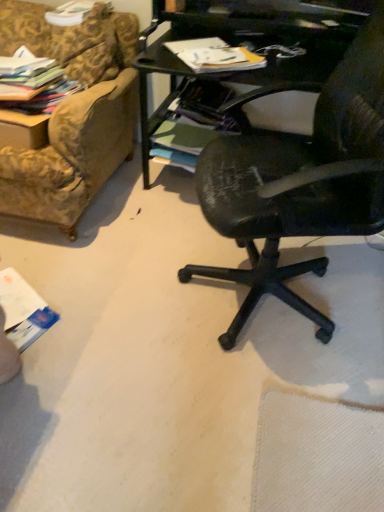
At what (x,y) coordinates should I click in order to perform the action: click on multicolored fabric stack at upper left, the 2th magazine when ordered from right to left. Please return your answer as a coordinate pair (x, y). This screenshot has width=384, height=512. Looking at the image, I should click on (34, 83).

Identify the location of matte paper magazine at upper center, which ranks as the 2th magazine in left-to-right order. (214, 56).

Is multicolored fabric stack at upper left, the 2th magazine when ordered from right to left, facing towards gold-patterned fabric couch at upper left?

No, multicolored fabric stack at upper left, the 2th magazine when ordered from right to left, is not oriented towards gold-patterned fabric couch at upper left.

Considering the sizes of multicolored fabric stack at upper left, the 2th magazine when ordered from right to left, and gold-patterned fabric couch at upper left in the image, is multicolored fabric stack at upper left, the 2th magazine when ordered from right to left, wider or thinner than gold-patterned fabric couch at upper left?

In the image, multicolored fabric stack at upper left, the 2th magazine when ordered from right to left, appears to be wider than gold-patterned fabric couch at upper left.

What's the angular difference between multicolored fabric stack at upper left, the first magazine viewed from the left, and gold-patterned fabric couch at upper left's facing directions?

They differ by 1.35 degrees in their facing directions.

Is matte paper magazine at upper center, which ranks as the 2th magazine in left-to-right order, facing away from gold-patterned fabric couch at upper left?

No, matte paper magazine at upper center, which ranks as the 2th magazine in left-to-right order, is not facing the opposite direction of gold-patterned fabric couch at upper left.

How many degrees apart are the facing directions of matte paper magazine at upper center, the first magazine when ordered from right to left, and gold-patterned fabric couch at upper left?

The angular difference between matte paper magazine at upper center, the first magazine when ordered from right to left, and gold-patterned fabric couch at upper left is 31.4 degrees.

From a real-world perspective, who is located lower, matte paper magazine at upper center, which ranks as the 2th magazine in left-to-right order, or gold-patterned fabric couch at upper left?

gold-patterned fabric couch at upper left, from a real-world perspective.

Is matte paper magazine at upper center, the first magazine when ordered from right to left, far away from gold-patterned fabric couch at upper left?

No, matte paper magazine at upper center, the first magazine when ordered from right to left, is not far away from gold-patterned fabric couch at upper left.

The width and height of the screenshot is (384, 512). I want to click on magazine below the matte paper magazine at upper center, the first magazine when ordered from right to left (from the image's perspective), so click(34, 83).

Measure the distance between matte paper magazine at upper center, which ranks as the 2th magazine in left-to-right order, and multicolored fabric stack at upper left, the 2th magazine when ordered from right to left.

matte paper magazine at upper center, which ranks as the 2th magazine in left-to-right order, is 25.09 inches from multicolored fabric stack at upper left, the 2th magazine when ordered from right to left.

Which is farther from the camera, (204, 68) or (21, 83)?

Point (21, 83)

From a real-world perspective, which object stands above the other?

matte paper magazine at upper center, the first magazine when ordered from right to left, from a real-world perspective.

Between multicolored fabric stack at upper left, the 2th magazine when ordered from right to left, and matte paper magazine at upper center, which ranks as the 2th magazine in left-to-right order, which one has more height?

With more height is matte paper magazine at upper center, which ranks as the 2th magazine in left-to-right order.

Considering the points (21, 110) and (257, 59), which point is in front, point (21, 110) or point (257, 59)?

The point (257, 59) is more forward.

Between multicolored fabric stack at upper left, the 2th magazine when ordered from right to left, and matte paper magazine at upper center, which ranks as the 2th magazine in left-to-right order, which one appears on the left side from the viewer's perspective?

multicolored fabric stack at upper left, the 2th magazine when ordered from right to left, is more to the left.

Image resolution: width=384 pixels, height=512 pixels. In order to click on magazine beneath the matte paper magazine at upper center, the first magazine when ordered from right to left (from a real-world perspective) in this screenshot , I will do (x=34, y=83).

Is gold-patterned fabric couch at upper left bigger than multicolored fabric stack at upper left, the first magazine viewed from the left?

Yes, gold-patterned fabric couch at upper left is bigger than multicolored fabric stack at upper left, the first magazine viewed from the left.

From a real-world perspective, is gold-patterned fabric couch at upper left beneath multicolored fabric stack at upper left, the 2th magazine when ordered from right to left?

Actually, gold-patterned fabric couch at upper left is physically above multicolored fabric stack at upper left, the 2th magazine when ordered from right to left, in the real world.

Is gold-patterned fabric couch at upper left at the right side of multicolored fabric stack at upper left, the first magazine viewed from the left?

No.

Is gold-patterned fabric couch at upper left positioned far away from multicolored fabric stack at upper left, the first magazine viewed from the left?

No, there isn't a large distance between gold-patterned fabric couch at upper left and multicolored fabric stack at upper left, the first magazine viewed from the left.

Is gold-patterned fabric couch at upper left facing towards matte paper magazine at upper center, which ranks as the 2th magazine in left-to-right order?

No, gold-patterned fabric couch at upper left is not facing towards matte paper magazine at upper center, which ranks as the 2th magazine in left-to-right order.

Locate an element on the screen. The height and width of the screenshot is (512, 384). studio couch on the left side of matte paper magazine at upper center, which ranks as the 2th magazine in left-to-right order is located at coordinates (72, 113).

From the image's perspective, is gold-patterned fabric couch at upper left under matte paper magazine at upper center, which ranks as the 2th magazine in left-to-right order?

Incorrect, from the image's perspective, gold-patterned fabric couch at upper left is higher than matte paper magazine at upper center, which ranks as the 2th magazine in left-to-right order.

Measure the distance from gold-patterned fabric couch at upper left to matte paper magazine at upper center, the first magazine when ordered from right to left.

A distance of 23.18 inches exists between gold-patterned fabric couch at upper left and matte paper magazine at upper center, the first magazine when ordered from right to left.

Find the location of a particular element. The height and width of the screenshot is (512, 384). studio couch behind the multicolored fabric stack at upper left, the first magazine viewed from the left is located at coordinates (72, 113).

Which magazine is the 2nd one when counting from the right side of the gold-patterned fabric couch at upper left? Please provide its 2D coordinates.

[(214, 56)]

Based on their spatial positions, is multicolored fabric stack at upper left, the first magazine viewed from the left, or matte paper magazine at upper center, which ranks as the 2th magazine in left-to-right order, further from gold-patterned fabric couch at upper left?

Based on the image, matte paper magazine at upper center, which ranks as the 2th magazine in left-to-right order, appears to be further to gold-patterned fabric couch at upper left.

Looking at the image, which one is located further to multicolored fabric stack at upper left, the first magazine viewed from the left, matte paper magazine at upper center, the first magazine when ordered from right to left, or gold-patterned fabric couch at upper left?

matte paper magazine at upper center, the first magazine when ordered from right to left, is positioned further to the anchor multicolored fabric stack at upper left, the first magazine viewed from the left.

Which object lies nearer to the anchor point matte paper magazine at upper center, the first magazine when ordered from right to left, gold-patterned fabric couch at upper left or multicolored fabric stack at upper left, the first magazine viewed from the left?

gold-patterned fabric couch at upper left is positioned closer to the anchor matte paper magazine at upper center, the first magazine when ordered from right to left.

Based on their spatial positions, is matte paper magazine at upper center, the first magazine when ordered from right to left, or multicolored fabric stack at upper left, the first magazine viewed from the left, closer to gold-patterned fabric couch at upper left?

multicolored fabric stack at upper left, the first magazine viewed from the left, is closer to gold-patterned fabric couch at upper left.

Based on their spatial positions, is gold-patterned fabric couch at upper left or matte paper magazine at upper center, the first magazine when ordered from right to left, closer to multicolored fabric stack at upper left, the first magazine viewed from the left?

gold-patterned fabric couch at upper left.

Which object lies nearer to the anchor point matte paper magazine at upper center, which ranks as the 2th magazine in left-to-right order, multicolored fabric stack at upper left, the 2th magazine when ordered from right to left, or gold-patterned fabric couch at upper left?

gold-patterned fabric couch at upper left lies closer to matte paper magazine at upper center, which ranks as the 2th magazine in left-to-right order, than the other object.

The width and height of the screenshot is (384, 512). I want to click on magazine situated between gold-patterned fabric couch at upper left and matte paper magazine at upper center, which ranks as the 2th magazine in left-to-right order, from left to right, so click(x=34, y=83).